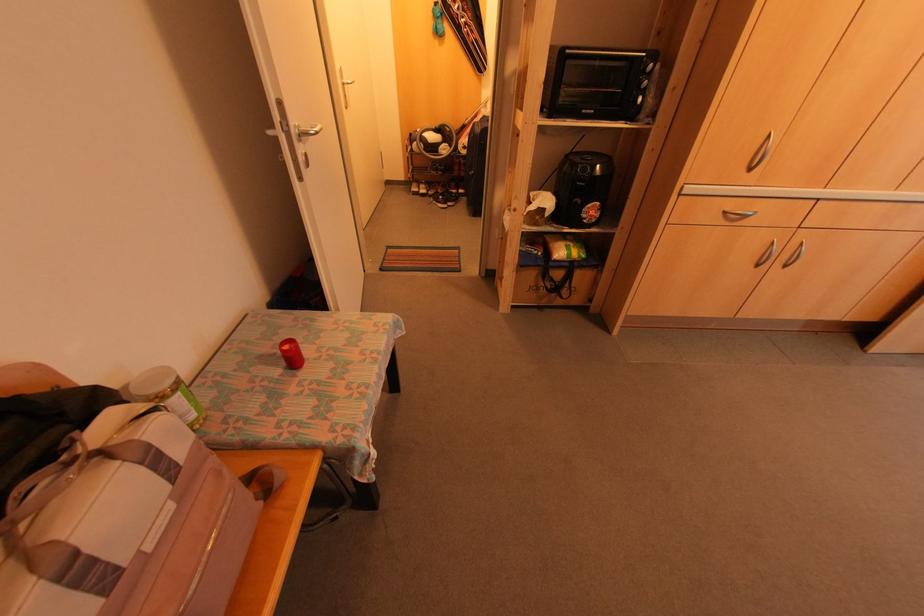
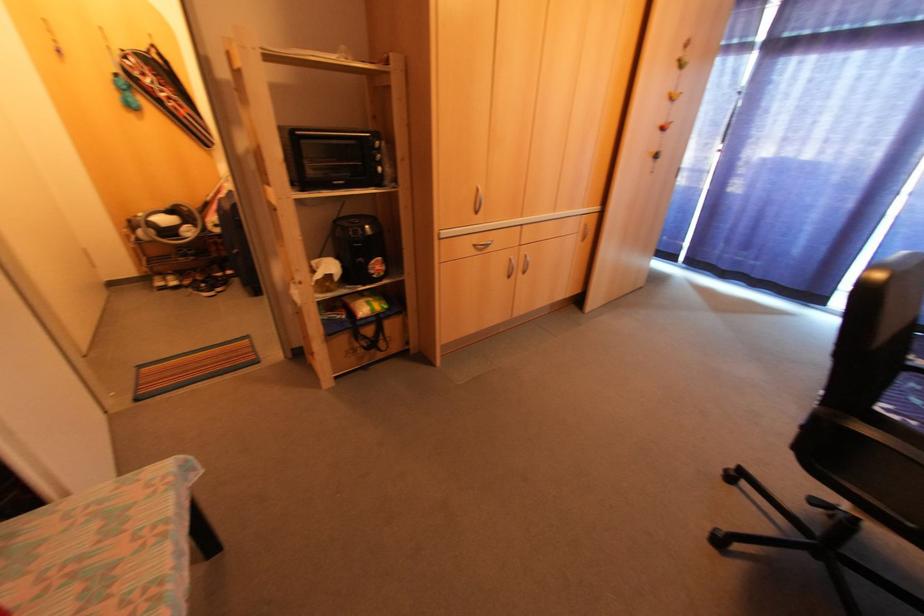
Question: Based on the continuous images, in which direction is the camera rotating? Reply with the corresponding letter.

Choices:
 (A) Left
 (B) Right
 (C) Up
 (D) Down

Answer: (B)